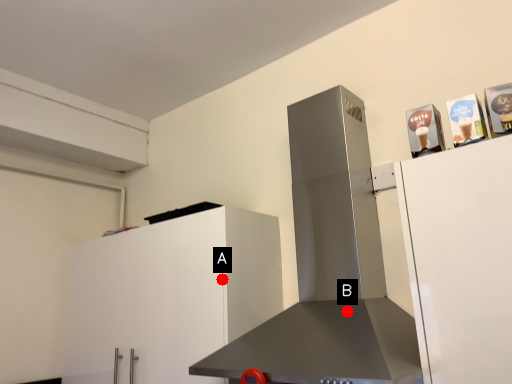
Question: Two points are circled on the image, labeled by A and B beside each circle. Which point is closer to the camera taking this photo?

Choices:
 (A) A is closer
 (B) B is closer

Answer: (B)